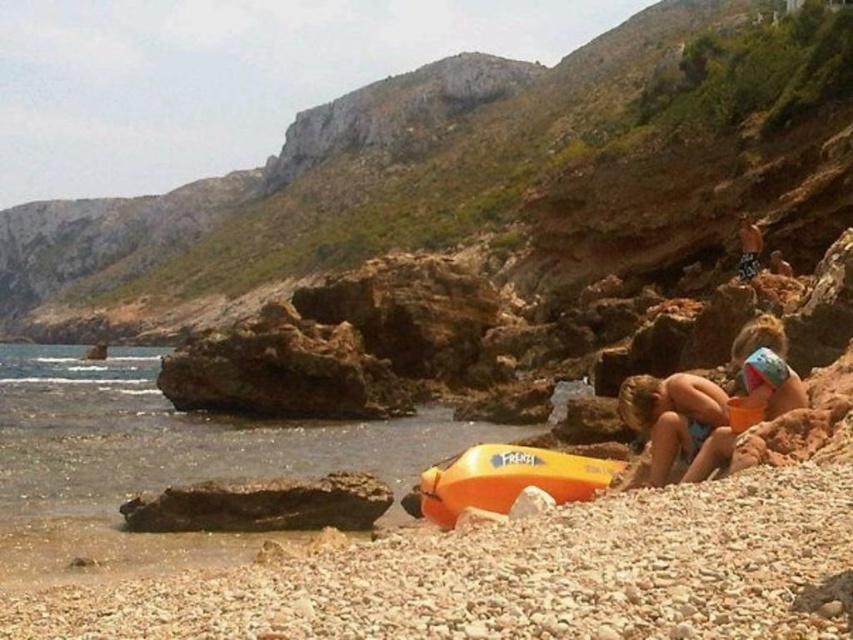
Between orange matte kayak at center and smooth brown rock at upper right, which one has more height?

smooth brown rock at upper right is taller.

At what (x,y) coordinates should I click in order to perform the action: click on orange matte kayak at center. Please return your answer as a coordinate pair (x, y). This screenshot has height=640, width=853. Looking at the image, I should click on (508, 477).

Can you confirm if matte yellow float at right is shorter than smooth brown rock at upper right?

Correct, matte yellow float at right is not as tall as smooth brown rock at upper right.

Which of these two, matte yellow float at right or smooth brown rock at upper right, stands taller?

Standing taller between the two is smooth brown rock at upper right.

Is point (746, 376) less distant than point (746, 257)?

Yes.

Locate an element on the screen. Image resolution: width=853 pixels, height=640 pixels. matte yellow float at right is located at coordinates (764, 369).

Is rough stone hillside at upper center thinner than smooth brown rock at upper right?

Incorrect, rough stone hillside at upper center's width is not less than smooth brown rock at upper right's.

Does point (547, 104) lie in front of point (738, 236)?

No, it is behind (738, 236).

This screenshot has width=853, height=640. Describe the element at coordinates (418, 160) in the screenshot. I see `rough stone hillside at upper center` at that location.

You are a GUI agent. You are given a task and a screenshot of the screen. Output one action in this format:
    pyautogui.click(x=<x>, y=<y>)
    Task: Click on the rough stone hillside at upper center
    The height and width of the screenshot is (640, 853).
    Given the screenshot: What is the action you would take?
    pyautogui.click(x=418, y=160)